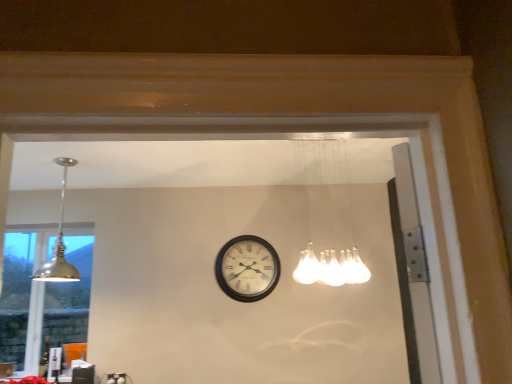
Question: In terms of size, does white frosted glass light fixture at upper center, which appears as the 2th lamp when viewed from the left, appear bigger or smaller than matte silver pendant light at upper left, placed as the second lamp when sorted from right to left?

Choices:
 (A) big
 (B) small

Answer: (A)

Question: Is white frosted glass light fixture at upper center, arranged as the 1th lamp when viewed from the right, in front of or behind matte silver pendant light at upper left, the 1th lamp viewed from the left, in the image?

Choices:
 (A) behind
 (B) front

Answer: (B)

Question: Which is nearer to the matte silver lampshade at left?

Choices:
 (A) white frosted glass light fixture at upper center, arranged as the 1th lamp when viewed from the right
 (B) black wooden clock at center
 (C) matte silver pendant light at upper left, placed as the second lamp when sorted from right to left

Answer: (C)

Question: Which is farther from the matte silver pendant light at upper left, the 1th lamp viewed from the left?

Choices:
 (A) black wooden clock at center
 (B) white frosted glass light fixture at upper center, which appears as the 2th lamp when viewed from the left
 (C) matte silver lampshade at left

Answer: (B)